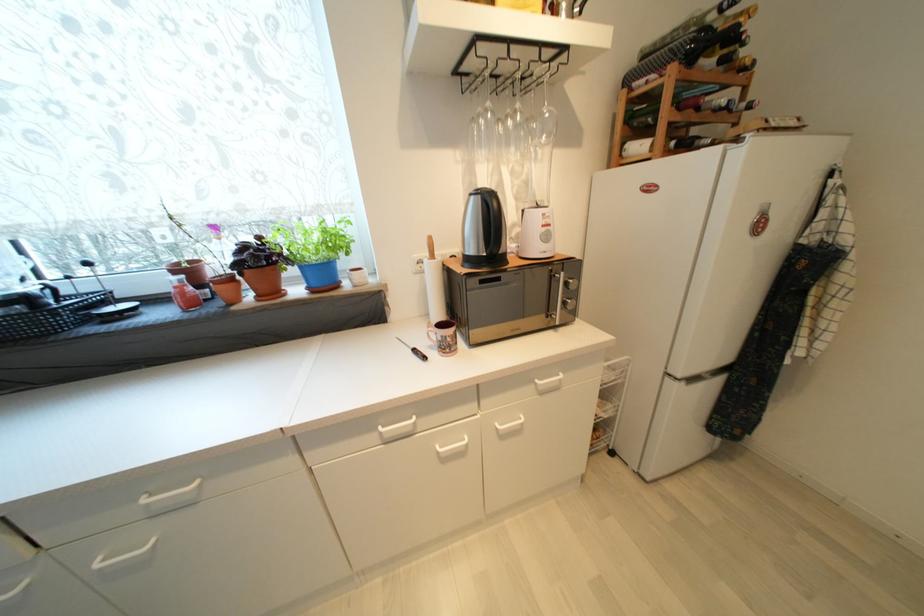
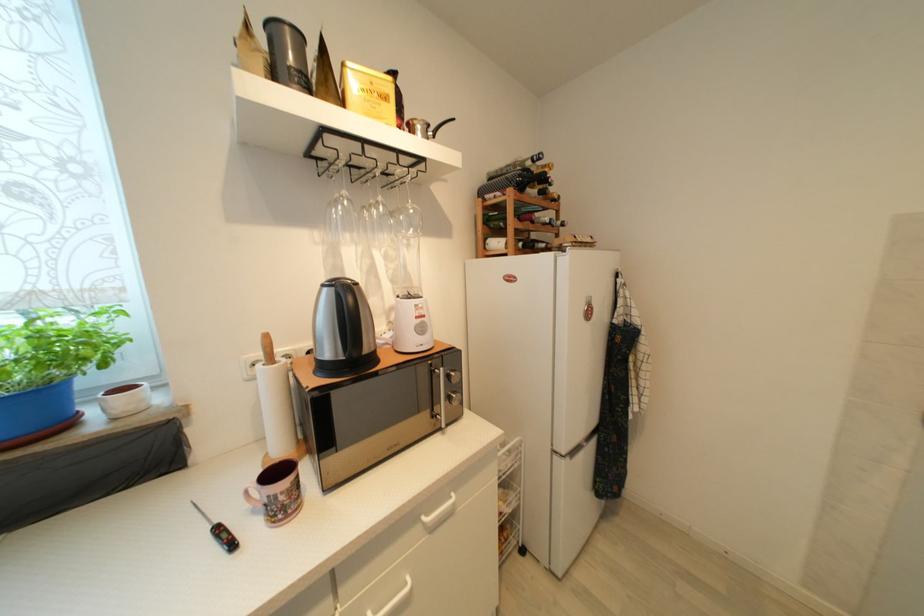
Locate, in the second image, the point that corresponds to [713,63] in the first image.

(538, 193)